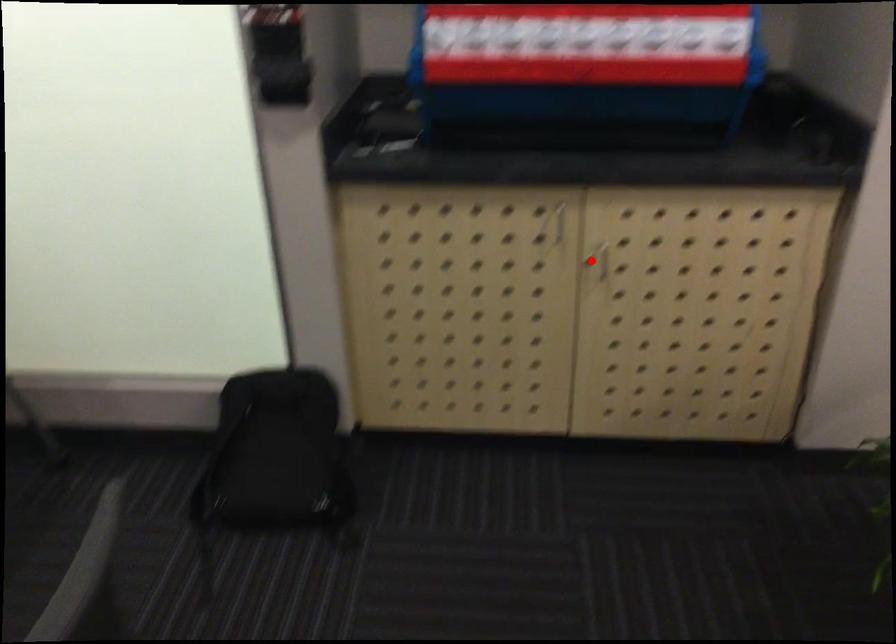
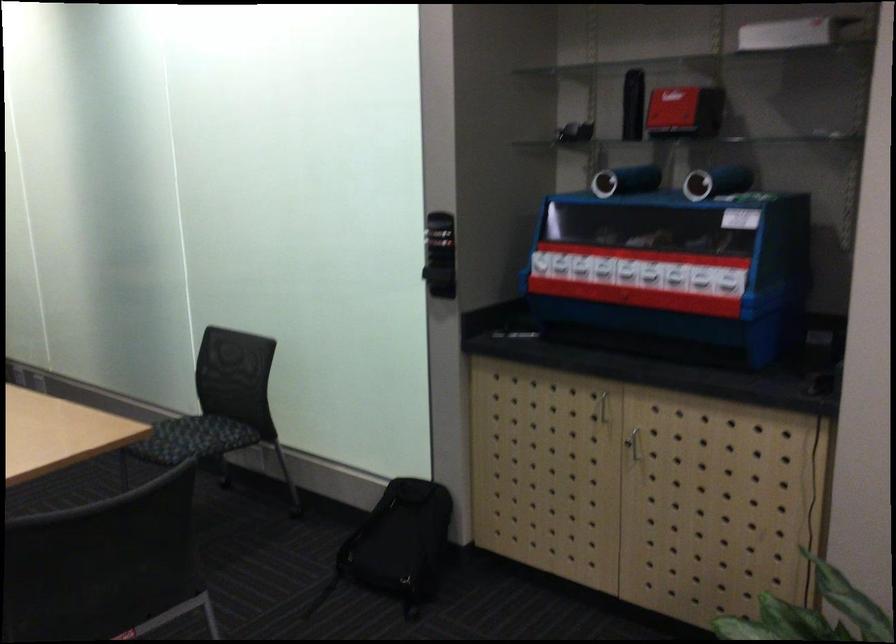
The point at the highlighted location is marked in the first image. Where is the corresponding point in the second image?

(633, 442)